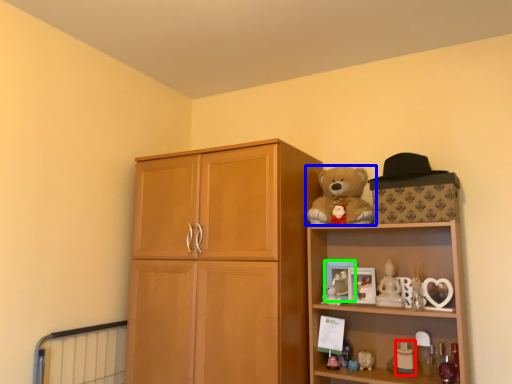
Question: Based on their relative distances, which object is nearer to toy (highlighted by a red box)? Choose from teddy bear (highlighted by a blue box) and picture frame (highlighted by a green box).

Choices:
 (A) teddy bear
 (B) picture frame

Answer: (B)